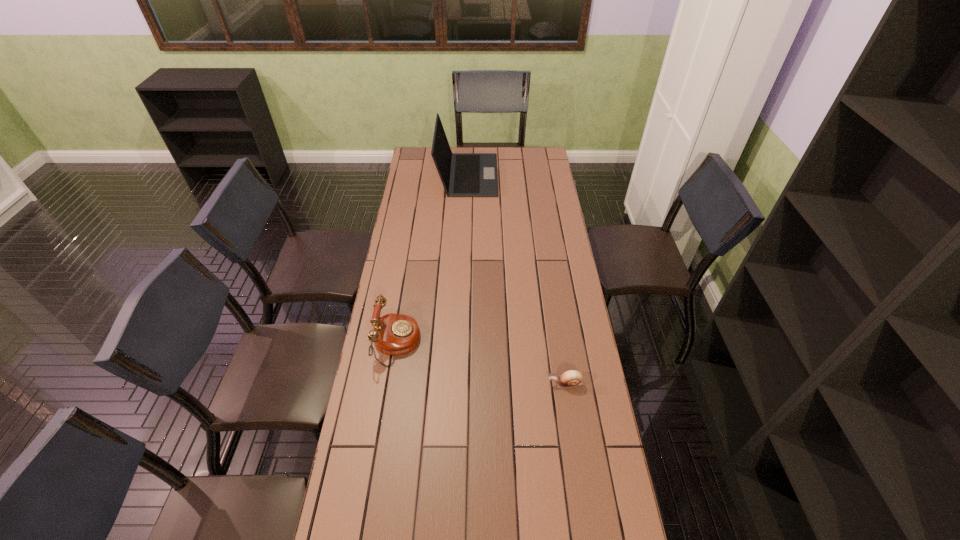
At what (x,y) coordinates should I click in order to perform the action: click on vacant region located 0.330m on the front-facing side of the nearest object. Please return your answer as a coordinate pair (x, y). Looking at the image, I should click on (448, 384).

At what (x,y) coordinates should I click in order to perform the action: click on object situated at the far edge. Please return your answer as a coordinate pair (x, y). This screenshot has height=540, width=960. Looking at the image, I should click on (462, 174).

I want to click on laptop positioned at the left edge, so (462, 174).

In order to click on telephone at the left edge in this screenshot , I will do `click(394, 334)`.

Identify the location of object that is at the right edge. The image size is (960, 540). (571, 378).

The image size is (960, 540). In order to click on object that is at the far left corner in this screenshot , I will do `click(462, 174)`.

Find the location of a particular element. free space at the left edge of the desktop is located at coordinates (432, 173).

Locate an element on the screen. vacant space at the right edge of the desktop is located at coordinates (576, 496).

Identify the location of blank area at the far right corner. (527, 168).

The height and width of the screenshot is (540, 960). What are the coordinates of `unoccupied area between the escargot and the laptop` in the screenshot? It's located at [x=516, y=279].